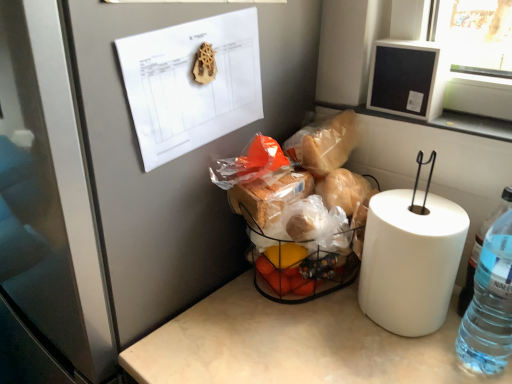
What do you see at coordinates (490, 304) in the screenshot? The width and height of the screenshot is (512, 384). I see `clear plastic bottle at right` at bounding box center [490, 304].

Measure the distance between white paper at upper left and camera.

white paper at upper left and camera are 23.85 inches apart from each other.

What is the approximate height of white paper at upper left?

It is 22.73 centimeters.

Where is `white glossy frame at upper right`? white glossy frame at upper right is located at coordinates (444, 121).

In the scene shown: Measure the distance between translucent plastic basket at center and camera.

The depth of translucent plastic basket at center is 31.50 inches.

Identify the location of wooden gear at upper center. Image resolution: width=512 pixels, height=384 pixels. (205, 64).

Looking at this image, is wooden gear at upper center inside or outside of white paper at upper left?

The correct answer is: inside.

From the image's perspective, is wooden gear at upper center above or below white paper at upper left?

Clearly, from the image's perspective, wooden gear at upper center is above white paper at upper left.

Between point (196, 80) and point (234, 18), which one is positioned in front?

The point (196, 80) is closer to the camera.

Considering the relative sizes of wooden gear at upper center and white paper at upper left in the image provided, is wooden gear at upper center wider than white paper at upper left?

No, wooden gear at upper center is not wider than white paper at upper left.

Does wooden gear at upper center have a lesser width compared to white glossy frame at upper right?

Correct, the width of wooden gear at upper center is less than that of white glossy frame at upper right.

Are wooden gear at upper center and white glossy frame at upper right making contact?

No, wooden gear at upper center is not touching white glossy frame at upper right.

In terms of size, does wooden gear at upper center appear bigger or smaller than white glossy frame at upper right?

In the image, wooden gear at upper center appears to be smaller than white glossy frame at upper right.

Considering the positions of objects wooden gear at upper center and white glossy frame at upper right in the image provided, who is more to the right, wooden gear at upper center or white glossy frame at upper right?

white glossy frame at upper right.

Does clear plastic bottle at right come behind white glossy frame at upper right?

No, clear plastic bottle at right is closer to the camera.

Is clear plastic bottle at right facing away from white glossy frame at upper right?

That's not correct — clear plastic bottle at right is not looking away from white glossy frame at upper right.

Considering the relative sizes of clear plastic bottle at right and white glossy frame at upper right in the image provided, is clear plastic bottle at right smaller than white glossy frame at upper right?

Incorrect, clear plastic bottle at right is not smaller in size than white glossy frame at upper right.

Is point (507, 320) closer to camera compared to point (490, 131)?

Yes, it is.

Is white paper at upper left completely or partially outside of clear plastic bottle at right?

Indeed, white paper at upper left is completely outside clear plastic bottle at right.

Between white paper at upper left and clear plastic bottle at right, which one has less height?

Standing shorter between the two is white paper at upper left.

Is white paper at upper left facing away from clear plastic bottle at right?

white paper at upper left does not have its back to clear plastic bottle at right.

Which of these two, white paper at upper left or clear plastic bottle at right, is thinner?

With smaller width is white paper at upper left.

Which is in front, point (202, 51) or point (260, 235)?

The point (202, 51) is closer to the camera.

From the image's perspective, is wooden gear at upper center below translucent plastic basket at center?

Actually, wooden gear at upper center appears above translucent plastic basket at center in the image.

Which is correct: wooden gear at upper center is inside translucent plastic basket at center, or outside of it?

wooden gear at upper center is not enclosed by translucent plastic basket at center.

Is white glossy frame at upper right positioned behind clear plastic bottle at right?

Yes, white glossy frame at upper right is further from the camera.

Does point (504, 121) come in front of point (458, 331)?

No, (504, 121) is behind (458, 331).

From a real-world perspective, is white glossy frame at upper right over clear plastic bottle at right?

Yes, from a real-world perspective, white glossy frame at upper right is above clear plastic bottle at right.

Considering the relative sizes of white glossy frame at upper right and clear plastic bottle at right in the image provided, is white glossy frame at upper right smaller than clear plastic bottle at right?

Correct, white glossy frame at upper right occupies less space than clear plastic bottle at right.

Could you tell me if translucent plastic basket at center is turned towards white paper at upper left?

No, translucent plastic basket at center is not facing towards white paper at upper left.

Can you tell me how much translucent plastic basket at center and white paper at upper left differ in facing direction?

There is a 88.4-degree angle between the facing directions of translucent plastic basket at center and white paper at upper left.

Considering the relative sizes of translucent plastic basket at center and white paper at upper left in the image provided, is translucent plastic basket at center taller than white paper at upper left?

Indeed, translucent plastic basket at center has a greater height compared to white paper at upper left.

From the image's perspective, between translucent plastic basket at center and white paper at upper left, who is located below?

From the image's view, translucent plastic basket at center is below.

Find the location of a particular element. paper below the wooden gear at upper center (from the image's perspective) is located at coordinates (191, 84).

This screenshot has height=384, width=512. What are the coordinates of `window sill on the right side of wooden gear at upper center` in the screenshot? It's located at (444, 121).

Which object lies nearer to the anchor point wooden gear at upper center, translucent plastic basket at center or black matte frame at upper right?

translucent plastic basket at center.

From the image, which object appears to be farther from clear plastic bottle at right, white glossy frame at upper right or translucent plastic basket at center?

The object further to clear plastic bottle at right is translucent plastic basket at center.

Looking at this image, which object lies nearer to the anchor point clear plastic bottle at right, translucent plastic basket at center or black matte frame at upper right?

Based on the image, translucent plastic basket at center appears to be nearer to clear plastic bottle at right.

When comparing their distances from wooden gear at upper center, does white paper at upper left or white glossy frame at upper right seem further?

white glossy frame at upper right is further to wooden gear at upper center.

Looking at the image, which one is located further to wooden gear at upper center, white paper at upper left or translucent plastic basket at center?

translucent plastic basket at center.

When comparing their distances from white paper at upper left, does clear plastic bottle at right or wooden gear at upper center seem closer?

wooden gear at upper center lies closer to white paper at upper left than the other object.

Which object lies further to the anchor point white paper at upper left, translucent plastic basket at center or clear plastic bottle at right?

clear plastic bottle at right lies further to white paper at upper left than the other object.

Based on their spatial positions, is black matte frame at upper right or wooden gear at upper center closer to white paper at upper left?

wooden gear at upper center is positioned closer to the anchor white paper at upper left.

At what (x,y) coordinates should I click in order to perform the action: click on window sill between black matte frame at upper right and clear plastic bottle at right vertically. Please return your answer as a coordinate pair (x, y). Looking at the image, I should click on (444, 121).

Where is `window screen located between wooden gear at upper center and white glossy frame at upper right in the left-right direction`? window screen located between wooden gear at upper center and white glossy frame at upper right in the left-right direction is located at coordinates pos(406,79).

Locate an element on the screen. window screen between translucent plastic basket at center and white glossy frame at upper right from left to right is located at coordinates [406, 79].

The width and height of the screenshot is (512, 384). I want to click on window sill between translucent plastic basket at center and clear plastic bottle at right, so click(x=444, y=121).